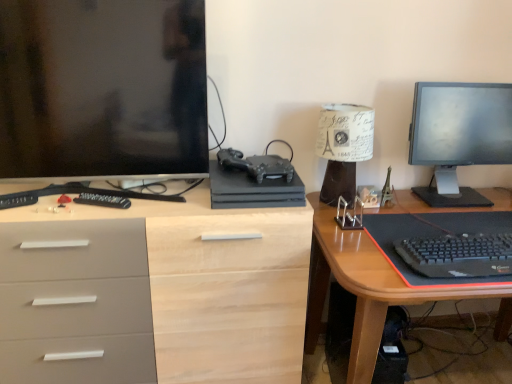
The image size is (512, 384). I want to click on vacant space in matte black monitor at upper right (from a real-world perspective), so click(438, 195).